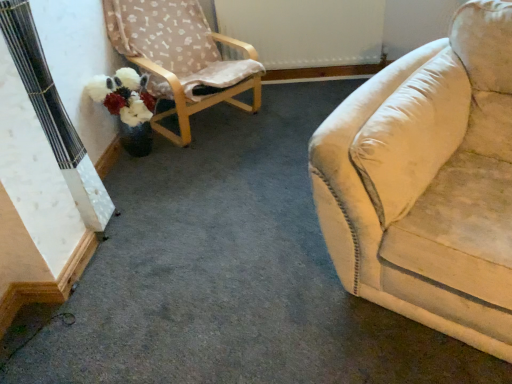
Question: Should I look upward or downward to see wooden chair with fabric cover at upper left?

Choices:
 (A) up
 (B) down

Answer: (A)

Question: Is wooden chair with fabric cover at upper left positioned with its back to fluffy white flower at lower left?

Choices:
 (A) yes
 (B) no

Answer: (B)

Question: Considering the relative positions of wooden chair with fabric cover at upper left and fluffy white flower at lower left in the image provided, is wooden chair with fabric cover at upper left to the left of fluffy white flower at lower left from the viewer's perspective?

Choices:
 (A) no
 (B) yes

Answer: (A)

Question: From a real-world perspective, is wooden chair with fabric cover at upper left located higher than fluffy white flower at lower left?

Choices:
 (A) no
 (B) yes

Answer: (B)

Question: Is wooden chair with fabric cover at upper left next to fluffy white flower at lower left?

Choices:
 (A) yes
 (B) no

Answer: (B)

Question: Would you consider wooden chair with fabric cover at upper left to be distant from fluffy white flower at lower left?

Choices:
 (A) no
 (B) yes

Answer: (A)

Question: Does wooden chair with fabric cover at upper left have a larger size compared to fluffy white flower at lower left?

Choices:
 (A) yes
 (B) no

Answer: (A)

Question: Is fluffy white flower at lower left aimed at wooden chair with fabric cover at upper left?

Choices:
 (A) yes
 (B) no

Answer: (A)

Question: Is wooden chair with fabric cover at upper left completely or partially inside fluffy white flower at lower left?

Choices:
 (A) no
 (B) yes

Answer: (A)

Question: From a real-world perspective, is fluffy white flower at lower left on top of wooden chair with fabric cover at upper left?

Choices:
 (A) yes
 (B) no

Answer: (B)

Question: Can you confirm if fluffy white flower at lower left is taller than wooden chair with fabric cover at upper left?

Choices:
 (A) yes
 (B) no

Answer: (B)

Question: Does fluffy white flower at lower left appear on the left side of wooden chair with fabric cover at upper left?

Choices:
 (A) yes
 (B) no

Answer: (A)

Question: Is the depth of fluffy white flower at lower left less than that of wooden chair with fabric cover at upper left?

Choices:
 (A) no
 (B) yes

Answer: (A)

Question: Considering their positions, is wooden chair with fabric cover at upper left located in front of or behind fluffy white flower at lower left?

Choices:
 (A) front
 (B) behind

Answer: (A)